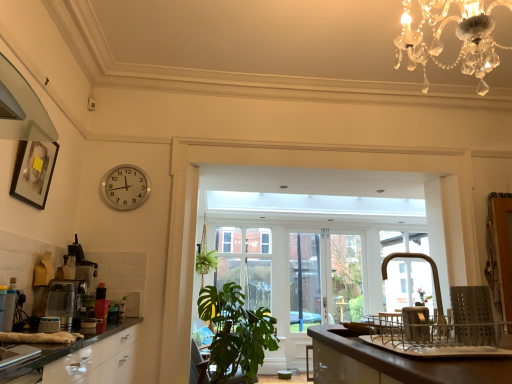
I want to click on free space to the left of satin silver dishwasher at lower right, acting as the 2th appliance starting from the left, so click(x=390, y=339).